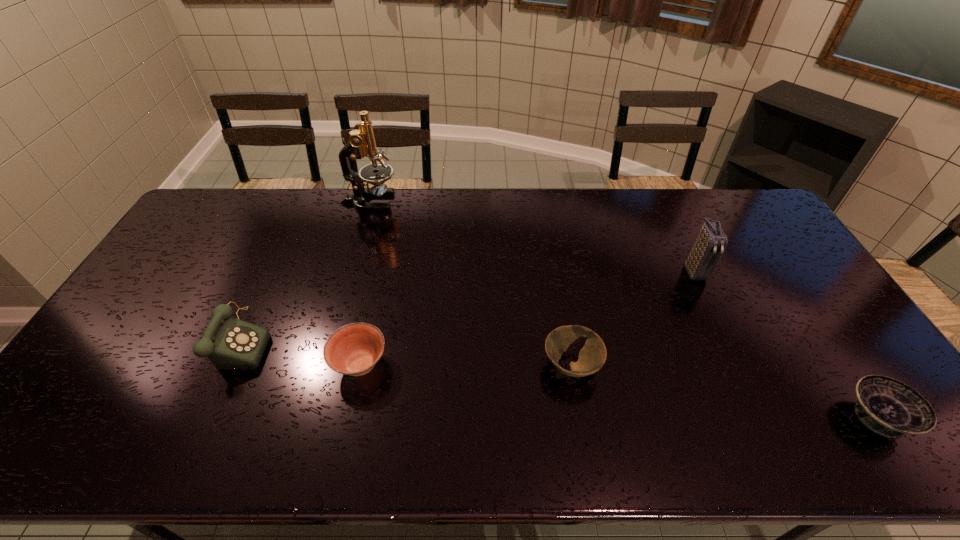
At what (x,y) coordinates should I click in order to perform the action: click on free space between the fifth nearest object and the farthest object. Please return your answer as a coordinate pair (x, y). Looking at the image, I should click on (532, 237).

Where is `vacant region between the leftmost bowl and the third object from right to left`? Image resolution: width=960 pixels, height=540 pixels. vacant region between the leftmost bowl and the third object from right to left is located at coordinates pyautogui.click(x=466, y=364).

At what (x,y) coordinates should I click in order to perform the action: click on free space between the rightmost object and the tallest object. Please return your answer as a coordinate pair (x, y). The height and width of the screenshot is (540, 960). Looking at the image, I should click on (623, 309).

Find the location of a particular element. This screenshot has height=540, width=960. unoccupied position between the leftmost bowl and the fourth shortest object is located at coordinates (300, 353).

I want to click on object that ranks as the third closest to the fifth object from left to right, so click(x=354, y=349).

You are a GUI agent. You are given a task and a screenshot of the screen. Output one action in this format:
    pyautogui.click(x=<x>, y=<y>)
    Task: Click on the fourth closest object to the rightmost bowl
    
    Given the screenshot: What is the action you would take?
    pyautogui.click(x=361, y=143)

The width and height of the screenshot is (960, 540). Identify the location of bowl that stands as the third closest to the second farthest object. (354, 349).

You are a GUI agent. You are given a task and a screenshot of the screen. Output one action in this format:
    pyautogui.click(x=<x>, y=<y>)
    Task: Click on the bowl that is the second closest one to the farthest object
    This screenshot has width=960, height=540.
    Given the screenshot: What is the action you would take?
    pyautogui.click(x=592, y=356)

This screenshot has height=540, width=960. What are the coordinates of `blank area in the image that satisfies the following two spatial constraints: 1. with the zip open on the rightmost bowl; 2. on the right side of the fifth shortest object` in the screenshot? It's located at (763, 417).

Where is `free space that satisfies the following two spatial constraints: 1. on the front side of the rightmost bowl; 2. on the left side of the fourth object from left to right`? Image resolution: width=960 pixels, height=540 pixels. free space that satisfies the following two spatial constraints: 1. on the front side of the rightmost bowl; 2. on the left side of the fourth object from left to right is located at coordinates (580, 417).